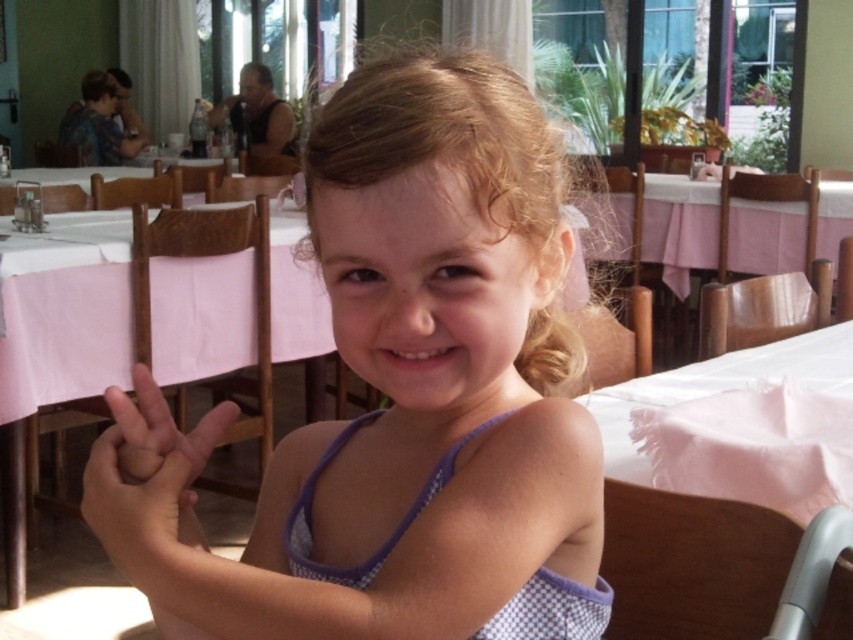
Question: Which point is farther to the camera?

Choices:
 (A) white checkered dress at center
 (B) smooth skin hand at center
 (C) pink fabric table at center

Answer: (C)

Question: Which object is the closest to the smooth skin hand at center?

Choices:
 (A) pink fabric table at center
 (B) white checkered dress at center

Answer: (B)

Question: Can you confirm if white checkered dress at center is smaller than smooth skin hand at center?

Choices:
 (A) yes
 (B) no

Answer: (B)

Question: Is white checkered dress at center in front of pink fabric table at center?

Choices:
 (A) yes
 (B) no

Answer: (A)

Question: Does white checkered dress at center come in front of pink fabric table at center?

Choices:
 (A) no
 (B) yes

Answer: (B)

Question: Which point appears closest to the camera in this image?

Choices:
 (A) (112, 547)
 (B) (178, 476)
 (C) (834, 234)

Answer: (A)